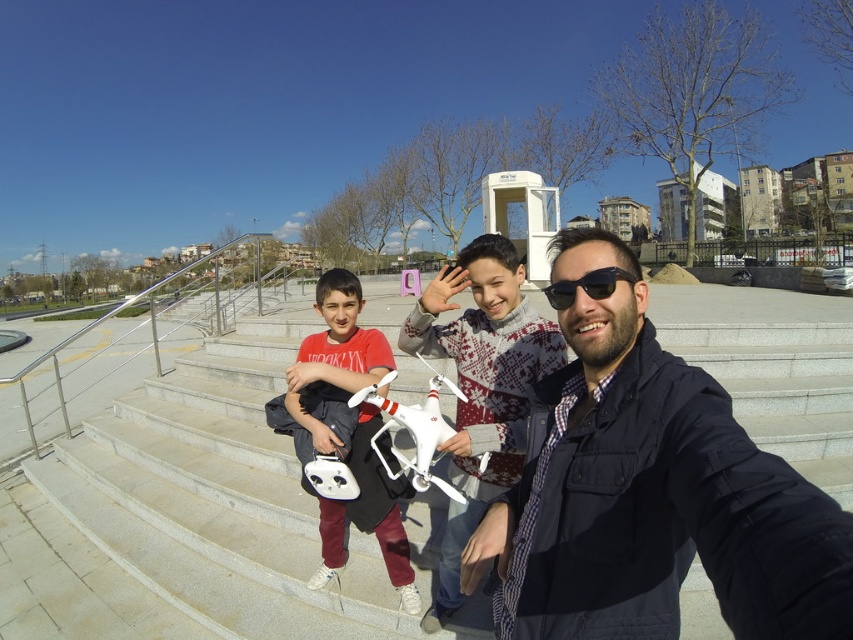
Is dark blue jacket at center to the right of sunglasses at center from the viewer's perspective?

Indeed, dark blue jacket at center is positioned on the right side of sunglasses at center.

Is the position of dark blue jacket at center more distant than that of sunglasses at center?

No, dark blue jacket at center is closer to the viewer.

Which is in front, point (839, 548) or point (572, 292)?

Positioned in front is point (839, 548).

Image resolution: width=853 pixels, height=640 pixels. Identify the location of dark blue jacket at center. (651, 493).

Which is below, matte white drone at center or sunglasses at center?

matte white drone at center

Is matte white drone at center to the left of sunglasses at center from the viewer's perspective?

Correct, you'll find matte white drone at center to the left of sunglasses at center.

Is point (381, 353) positioned after point (544, 289)?

No, it is in front of (544, 289).

Find the location of `matte white drone at center`. matte white drone at center is located at coordinates pyautogui.click(x=335, y=355).

Which of these two, white matte drone at center or sunglasses at center, stands taller?

With more height is white matte drone at center.

Can you confirm if white matte drone at center is bigger than sunglasses at center?

Indeed, white matte drone at center has a larger size compared to sunglasses at center.

Between point (500, 256) and point (601, 289), which one is positioned in front?

Point (601, 289)

This screenshot has height=640, width=853. I want to click on white matte drone at center, so click(x=480, y=387).